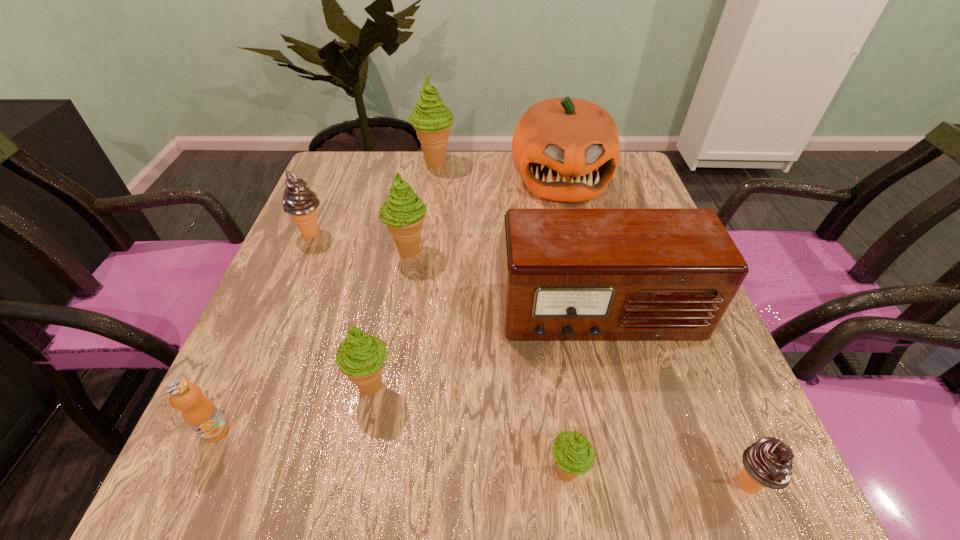
This screenshot has height=540, width=960. I want to click on the third closest green icecream to the orange juice, so click(x=573, y=454).

Find the location of a particular element. This screenshot has height=540, width=960. vacant space that satisfies the following two spatial constraints: 1. on the front label of the orange juice; 2. on the right side of the right chocolate icecream is located at coordinates (192, 484).

Where is `vacant position in the image that satisfies the following two spatial constraints: 1. on the front side of the third smallest green icecream; 2. on the right side of the rightmost green icecream`? Image resolution: width=960 pixels, height=540 pixels. vacant position in the image that satisfies the following two spatial constraints: 1. on the front side of the third smallest green icecream; 2. on the right side of the rightmost green icecream is located at coordinates (372, 472).

I want to click on free location that satisfies the following two spatial constraints: 1. on the back side of the fourth nearest object; 2. on the left side of the second biggest green icecream, so click(397, 251).